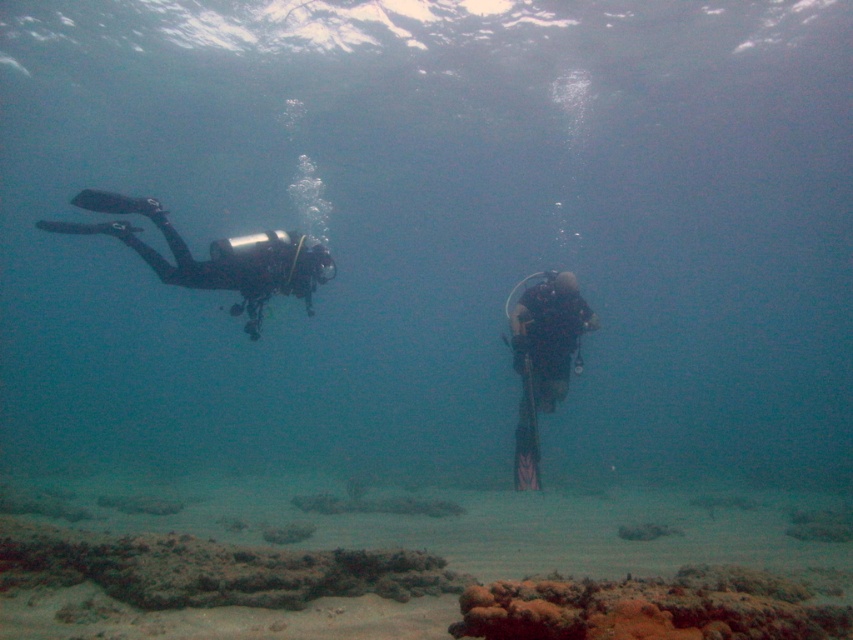
Question: Considering the relative positions of black matte scuba diver at left and black matte scuba diver at center in the image provided, where is black matte scuba diver at left located with respect to black matte scuba diver at center?

Choices:
 (A) below
 (B) above

Answer: (B)

Question: Which point is closer to the camera taking this photo?

Choices:
 (A) coord(251,336)
 (B) coord(560,385)

Answer: (B)

Question: Can you confirm if black matte scuba diver at left is positioned to the right of black matte scuba diver at center?

Choices:
 (A) no
 (B) yes

Answer: (A)

Question: Is black matte scuba diver at left wider than black matte scuba diver at center?

Choices:
 (A) yes
 (B) no

Answer: (A)